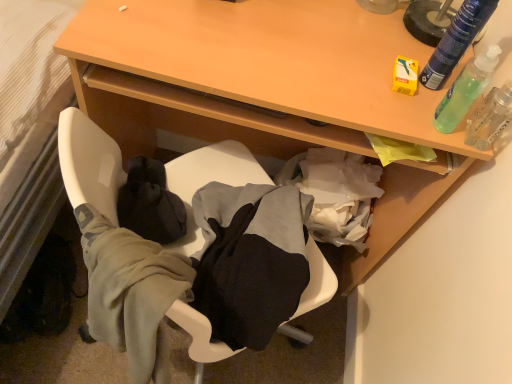
Question: Should I look upward or downward to see green translucent bottle at upper right, the 1th bottle positioned from the top?

Choices:
 (A) down
 (B) up

Answer: (B)

Question: From a real-world perspective, is clear plastic spray bottle at upper right physically below soft fabric chair at lower center?

Choices:
 (A) no
 (B) yes

Answer: (A)

Question: Does clear plastic spray bottle at upper right lie behind soft fabric chair at lower center?

Choices:
 (A) no
 (B) yes

Answer: (B)

Question: Does clear plastic spray bottle at upper right turn towards soft fabric chair at lower center?

Choices:
 (A) yes
 (B) no

Answer: (B)

Question: Is the surface of clear plastic spray bottle at upper right in direct contact with soft fabric chair at lower center?

Choices:
 (A) yes
 (B) no

Answer: (B)

Question: Is clear plastic spray bottle at upper right not near soft fabric chair at lower center?

Choices:
 (A) yes
 (B) no

Answer: (B)

Question: Considering the relative positions of clear plastic spray bottle at upper right and soft fabric chair at lower center in the image provided, is clear plastic spray bottle at upper right to the right of soft fabric chair at lower center from the viewer's perspective?

Choices:
 (A) yes
 (B) no

Answer: (A)

Question: Is soft fabric chair at lower center aimed at wooden table at upper center?

Choices:
 (A) no
 (B) yes

Answer: (B)

Question: Does soft fabric chair at lower center come in front of wooden table at upper center?

Choices:
 (A) yes
 (B) no

Answer: (A)

Question: Considering the relative sizes of soft fabric chair at lower center and wooden table at upper center in the image provided, is soft fabric chair at lower center shorter than wooden table at upper center?

Choices:
 (A) no
 (B) yes

Answer: (B)

Question: Is soft fabric chair at lower center thinner than wooden table at upper center?

Choices:
 (A) yes
 (B) no

Answer: (A)

Question: Considering the relative sizes of soft fabric chair at lower center and wooden table at upper center in the image provided, is soft fabric chair at lower center taller than wooden table at upper center?

Choices:
 (A) yes
 (B) no

Answer: (B)

Question: Is soft fabric chair at lower center located outside wooden table at upper center?

Choices:
 (A) yes
 (B) no

Answer: (A)

Question: From the image's perspective, would you say green translucent bottle at upper right, the 2th bottle in the top-to-bottom sequence, is shown under clear plastic spray bottle at upper right?

Choices:
 (A) yes
 (B) no

Answer: (B)